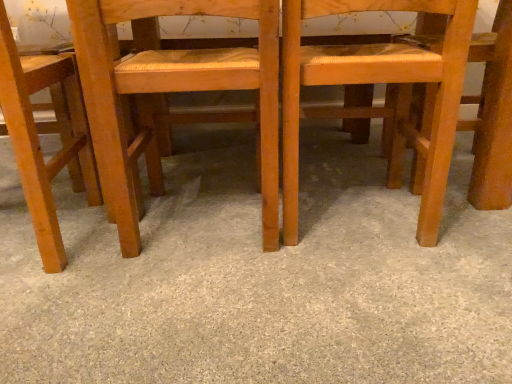
Question: Is wooden chair at center, which is counted as the third chair, starting from the left, completely or partially inside gray carpet at center?

Choices:
 (A) yes
 (B) no

Answer: (B)

Question: Is gray carpet at center in front of wooden chair at center, which is counted as the third chair, starting from the left?

Choices:
 (A) yes
 (B) no

Answer: (A)

Question: Does gray carpet at center have a larger size compared to wooden chair at center, the 1th chair in the right-to-left sequence?

Choices:
 (A) no
 (B) yes

Answer: (B)

Question: Is gray carpet at center looking in the opposite direction of wooden chair at center, which is counted as the third chair, starting from the left?

Choices:
 (A) no
 (B) yes

Answer: (A)

Question: Is gray carpet at center behind wooden chair at center, the 1th chair in the right-to-left sequence?

Choices:
 (A) no
 (B) yes

Answer: (A)

Question: From the image's perspective, is gray carpet at center over wooden chair at center, which is counted as the third chair, starting from the left?

Choices:
 (A) no
 (B) yes

Answer: (A)

Question: From the image's perspective, is wooden chair at center, which is counted as the third chair, starting from the left, above matte wood chair at left, which is the third chair in right-to-left order?

Choices:
 (A) no
 (B) yes

Answer: (B)

Question: Considering the relative positions of wooden chair at center, which is counted as the third chair, starting from the left, and matte wood chair at left, which is the third chair in right-to-left order, in the image provided, is wooden chair at center, which is counted as the third chair, starting from the left, to the left of matte wood chair at left, which is the third chair in right-to-left order, from the viewer's perspective?

Choices:
 (A) no
 (B) yes

Answer: (A)

Question: Is there a large distance between wooden chair at center, the 1th chair in the right-to-left sequence, and matte wood chair at left, the first chair in the left-to-right sequence?

Choices:
 (A) yes
 (B) no

Answer: (B)

Question: From a real-world perspective, is wooden chair at center, the 1th chair in the right-to-left sequence, physically below matte wood chair at left, the first chair in the left-to-right sequence?

Choices:
 (A) no
 (B) yes

Answer: (B)

Question: Is wooden chair at center, which is counted as the third chair, starting from the left, located outside matte wood chair at left, the first chair in the left-to-right sequence?

Choices:
 (A) yes
 (B) no

Answer: (A)

Question: Does wooden chair at center, the 1th chair in the right-to-left sequence, have a smaller size compared to matte wood chair at left, which is the third chair in right-to-left order?

Choices:
 (A) yes
 (B) no

Answer: (B)

Question: From a real-world perspective, is wooden chair at center, the 2th chair when ordered from right to left, under matte wood chair at left, the first chair in the left-to-right sequence?

Choices:
 (A) no
 (B) yes

Answer: (B)